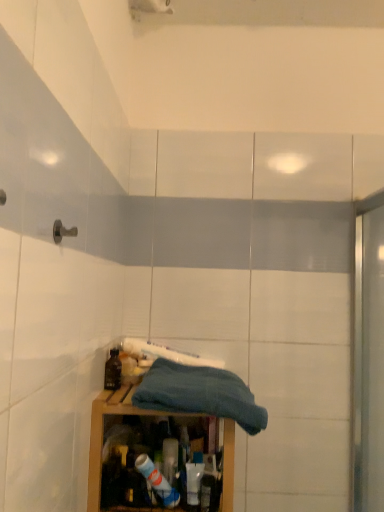
Question: Is blue cotton towel at center taller or shorter than matte black bottle at lower left?

Choices:
 (A) tall
 (B) short

Answer: (A)

Question: From a real-world perspective, is blue cotton towel at center positioned above or below matte black bottle at lower left?

Choices:
 (A) below
 (B) above

Answer: (A)

Question: Which is farther from the wooden cabinet at lower center?

Choices:
 (A) blue cotton towel at center
 (B) matte black bottle at lower left

Answer: (B)

Question: Which of these objects is positioned farthest from the wooden cabinet at lower center?

Choices:
 (A) matte black bottle at lower left
 (B) blue cotton towel at center

Answer: (A)